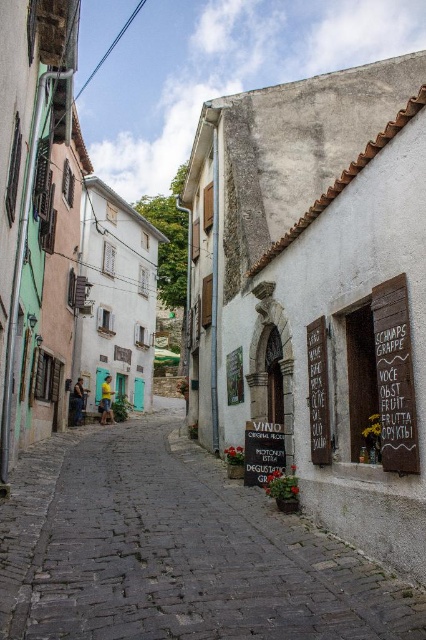
Question: Which object appears closest to the camera in this image?

Choices:
 (A) black matte sign at center
 (B) brown wooden signboard at right
 (C) black wood sign at right
 (D) brick cobblestone street at center

Answer: (D)

Question: Is brown wooden signboard at right smaller than black matte sign at center?

Choices:
 (A) no
 (B) yes

Answer: (B)

Question: Is brick cobblestone street at center further to the viewer compared to brown wooden signboard at right?

Choices:
 (A) yes
 (B) no

Answer: (B)

Question: Based on their relative distances, which object is farther from the black matte sign at center?

Choices:
 (A) brick cobblestone street at center
 (B) black wood sign at right

Answer: (B)

Question: Can you confirm if brick cobblestone street at center is positioned to the right of brown wooden signboard at right?

Choices:
 (A) no
 (B) yes

Answer: (A)

Question: Which object is the farthest from the brick cobblestone street at center?

Choices:
 (A) brown wooden signboard at right
 (B) black wood sign at right

Answer: (A)